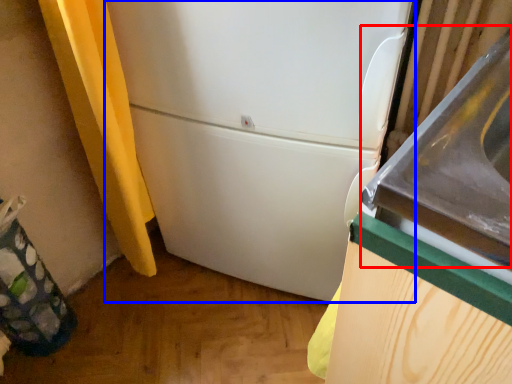
Question: Which object appears farthest to the camera in this image, sink (highlighted by a red box) or refrigerator (highlighted by a blue box)?

Choices:
 (A) sink
 (B) refrigerator

Answer: (B)